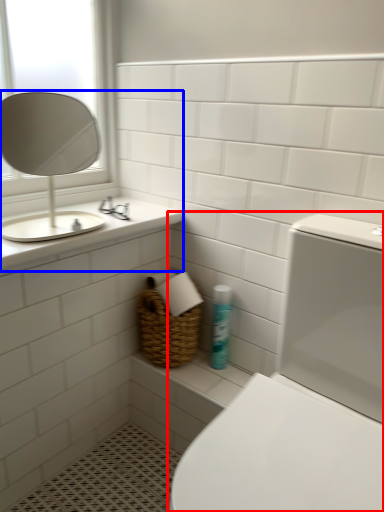
Question: Among these objects, which one is nearest to the camera, toilet (highlighted by a red box) or sink (highlighted by a blue box)?

Choices:
 (A) toilet
 (B) sink

Answer: (A)